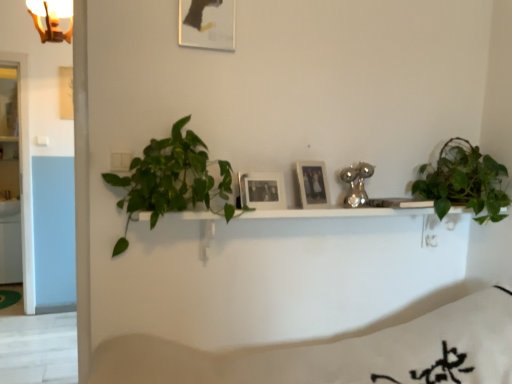
Question: Considering the positions of green matte plant at upper right, placed as the 2th houseplant when sorted from left to right, and green leafy plant at left, which ranks as the second houseplant in right-to-left order, in the image, is green matte plant at upper right, placed as the 2th houseplant when sorted from left to right, wider or thinner than green leafy plant at left, which ranks as the second houseplant in right-to-left order,?

Choices:
 (A) wide
 (B) thin

Answer: (A)

Question: Is green matte plant at upper right, placed as the 2th houseplant when sorted from left to right, in front of or behind green leafy plant at left, which ranks as the second houseplant in right-to-left order, in the image?

Choices:
 (A) behind
 (B) front

Answer: (A)

Question: Based on their relative distances, which object is nearer to the matte black picture frame at upper center, the 1th picture frame positioned from the top?

Choices:
 (A) green matte plant at upper right, acting as the first houseplant starting from the right
 (B) white matte bedding at lower center
 (C) black matte picture frame at center, which is counted as the 2th picture frame, starting from the right
 (D) green leafy plant at left, which ranks as the second houseplant in right-to-left order
 (E) gold metallic light fixture at upper left

Answer: (D)

Question: Based on their relative distances, which object is farther from the white matte bedding at lower center?

Choices:
 (A) matte black picture frame at center, positioned as the third picture frame in left-to-right order
 (B) matte black picture frame at upper center, the first picture frame viewed from the left
 (C) gold metallic light fixture at upper left
 (D) green leafy plant at left, which ranks as the second houseplant in right-to-left order
 (E) black matte picture frame at center, the second picture frame when ordered from left to right

Answer: (C)